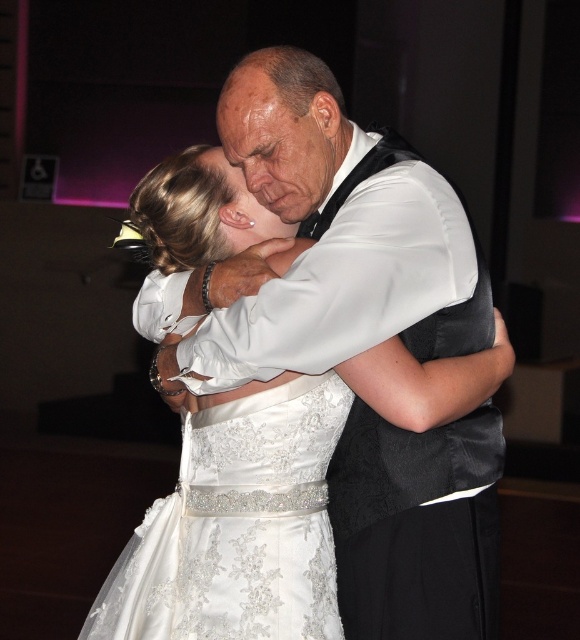
In the scene shown: You are standing in the same room as the two dancing individuals. You want to place a small bouquet of flowers exactly halfway between point A at point [226,618] and point B at point [241,593]. Which point, A or B, will the bouquet be closer to after placing it halfway?

The bouquet will be closer to point B at [241,593] because when you calculate the midpoint between point A at [226,618] and point B at [241,593], the midpoint is closer to point B due to their spatial arrangement.